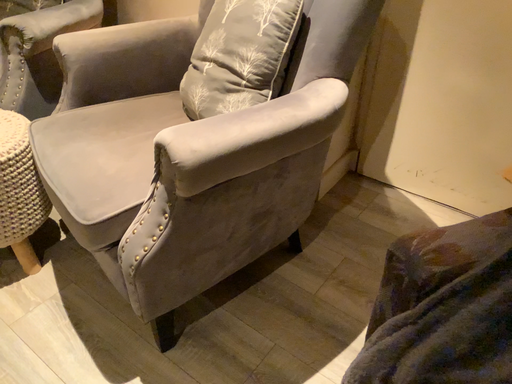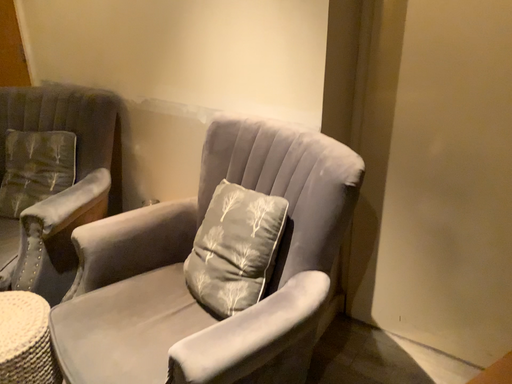
Question: How did the camera likely rotate when shooting the video?

Choices:
 (A) rotated upward
 (B) rotated downward

Answer: (A)